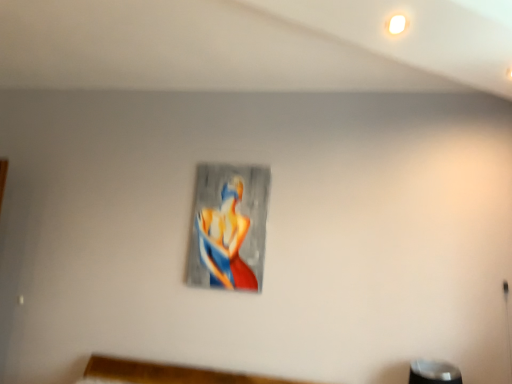
Where is `abstract painting at center`? This screenshot has height=384, width=512. abstract painting at center is located at coordinates (225, 240).

What do you see at coordinates (225, 240) in the screenshot? The height and width of the screenshot is (384, 512). I see `abstract painting at center` at bounding box center [225, 240].

Locate an element on the screen. abstract painting at center is located at coordinates (225, 240).